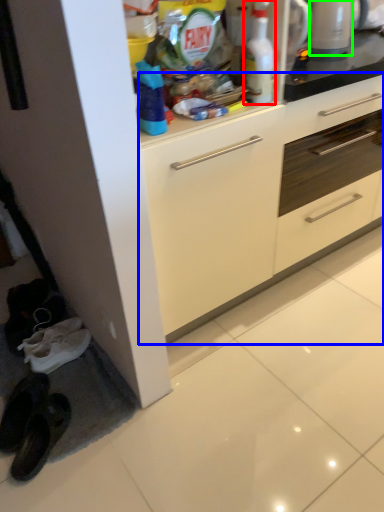
Question: Which object is positioned farthest from cleaning product (highlighted by a red box)? Select from cabinetry (highlighted by a blue box) and appliance (highlighted by a green box).

Choices:
 (A) cabinetry
 (B) appliance

Answer: (A)